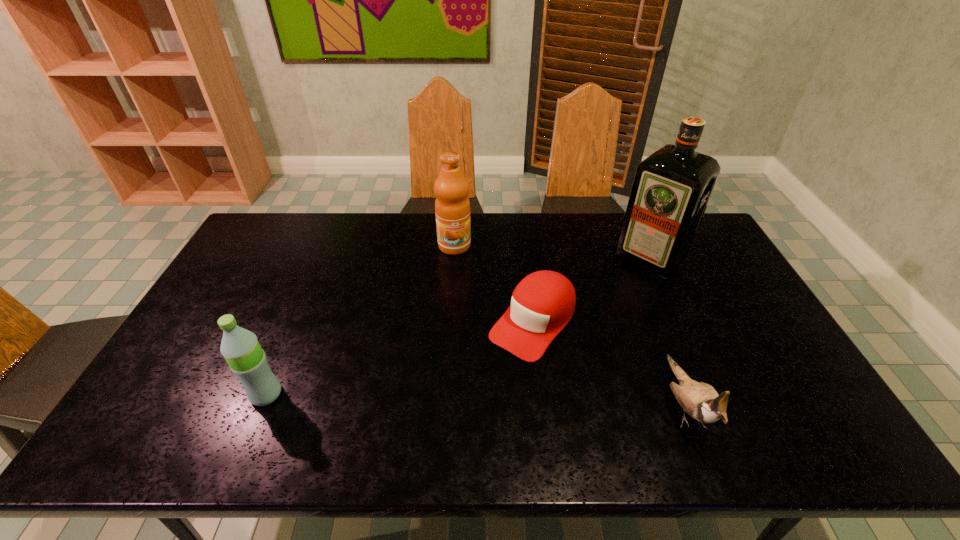
In order to click on vacant space on the desktop that is between the third tallest object and the bird and is positioned on the label side of the fruit juice in this screenshot , I will do `click(467, 399)`.

Identify the location of free spot on the desktop that is between the water bottle and the bird and is positioned on the front-facing side of the shortest object. The height and width of the screenshot is (540, 960). (466, 399).

Locate an element on the screen. This screenshot has height=540, width=960. free space on the desktop that is between the third tallest object and the bird and is positioned on the front label of the tallest object is located at coordinates (508, 399).